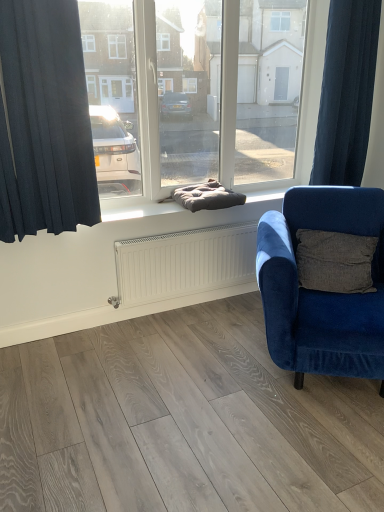
Measure the distance between point (355, 334) and camera.

A distance of 1.84 meters exists between point (355, 334) and camera.

Where is `dark blue fabric curtain at left, which ranks as the 1th curtain in left-to-right order`? dark blue fabric curtain at left, which ranks as the 1th curtain in left-to-right order is located at coordinates (44, 121).

Where is `dark blue fabric curtain at right, the 1th curtain from the right`? The height and width of the screenshot is (512, 384). dark blue fabric curtain at right, the 1th curtain from the right is located at coordinates pos(346,93).

You are a GUI agent. You are given a task and a screenshot of the screen. Output one action in this format:
    pyautogui.click(x=<x>, y=<y>)
    Task: Click on the velvet blue armchair at right
    This screenshot has width=384, height=512.
    Given the screenshot: What is the action you would take?
    pyautogui.click(x=320, y=291)

Is point (10, 150) less distant than point (369, 130)?

Yes.

Can you see dark blue fabric curtain at left, arranged as the 2th curtain when viewed from the back, touching dark blue fabric curtain at right, the 1th curtain from the right?

There is a gap between dark blue fabric curtain at left, arranged as the 2th curtain when viewed from the back, and dark blue fabric curtain at right, the 1th curtain from the right.

From the image's perspective, which is above, dark blue fabric curtain at right, which is the first curtain in back-to-front order, or dark gray cushion at center?

dark blue fabric curtain at right, which is the first curtain in back-to-front order, is shown above in the image.

Between dark blue fabric curtain at right, which is the first curtain in back-to-front order, and dark gray cushion at center, which one has smaller size?

Smaller between the two is dark gray cushion at center.

Is dark blue fabric curtain at right, which is the first curtain in back-to-front order, inside the boundaries of dark gray cushion at center, or outside?

dark blue fabric curtain at right, which is the first curtain in back-to-front order, is not enclosed by dark gray cushion at center.

From a real-world perspective, which object rests below the other?

In real-world perspective, dark gray cushion at center is lower.

Is velvet blue armchair at right aimed at dark gray cushion at center?

Result: No.

Which is closer, (274,330) or (145,211)?

Clearly, point (274,330) is closer to the camera than point (145,211).

Is velvet blue armchair at right behind dark gray cushion at center?

No.

Between velvet blue armchair at right and dark gray cushion at center, which one has larger width?

With larger width is velvet blue armchair at right.

Is dark blue fabric curtain at right, which is counted as the second curtain, starting from the front, bigger than velvet blue armchair at right?

No.

Does point (335, 87) appear closer or farther from the camera than point (382, 218)?

Clearly, point (335, 87) is more distant from the camera than point (382, 218).

How different are the orientations of dark blue fabric curtain at right, marked as the 2th curtain in a left-to-right arrangement, and velvet blue armchair at right in degrees?

The angular difference between dark blue fabric curtain at right, marked as the 2th curtain in a left-to-right arrangement, and velvet blue armchair at right is 33.7 degrees.

Which of these two, dark blue fabric curtain at right, which is counted as the second curtain, starting from the front, or velvet blue armchair at right, stands taller?

Standing taller between the two is dark blue fabric curtain at right, which is counted as the second curtain, starting from the front.

Based on the photo, can you confirm if dark gray cushion at center is wider than dark blue fabric curtain at right, marked as the 2th curtain in a left-to-right arrangement?

Yes.

In terms of size, does dark gray cushion at center appear bigger or smaller than dark blue fabric curtain at right, which is the first curtain in back-to-front order?

Considering their sizes, dark gray cushion at center takes up less space than dark blue fabric curtain at right, which is the first curtain in back-to-front order.

Between point (273, 259) and point (361, 0), which one is positioned behind?

Positioned behind is point (361, 0).

From a real-world perspective, is velvet blue armchair at right physically below dark blue fabric curtain at right, the 1th curtain from the right?

Yes, from a real-world perspective, velvet blue armchair at right is below dark blue fabric curtain at right, the 1th curtain from the right.

Is velvet blue armchair at right shorter than dark blue fabric curtain at right, the 1th curtain from the right?

Yes.

What's the angular difference between velvet blue armchair at right and dark blue fabric curtain at right, which is counted as the second curtain, starting from the front,'s facing directions?

velvet blue armchair at right and dark blue fabric curtain at right, which is counted as the second curtain, starting from the front, are facing 33.7 degrees away from each other.

Can you confirm if dark gray cushion at center is bigger than velvet blue armchair at right?

Actually, dark gray cushion at center might be smaller than velvet blue armchair at right.

Is dark gray cushion at center touching velvet blue armchair at right?

No.

From the image's perspective, is dark gray cushion at center located beneath velvet blue armchair at right?

No, from the image's perspective, dark gray cushion at center is not below velvet blue armchair at right.

This screenshot has height=512, width=384. What are the coordinates of `curtain above the dark blue fabric curtain at left, arranged as the 2th curtain when viewed from the back (from the image's perspective)` in the screenshot? It's located at (346, 93).

From a real-world perspective, which curtain is the 2nd one above the dark gray cushion at center? Please provide its 2D coordinates.

[(346, 93)]

Looking at the image, which one is located closer to dark blue fabric curtain at right, marked as the 2th curtain in a left-to-right arrangement, velvet blue armchair at right or dark blue fabric curtain at left, the first curtain in the front-to-back sequence?

velvet blue armchair at right is closer to dark blue fabric curtain at right, marked as the 2th curtain in a left-to-right arrangement.

Considering their positions, is dark gray cushion at center positioned closer to dark blue fabric curtain at left, the first curtain in the front-to-back sequence, than velvet blue armchair at right?

dark gray cushion at center lies closer to dark blue fabric curtain at left, the first curtain in the front-to-back sequence, than the other object.

Considering their positions, is dark blue fabric curtain at right, the 1th curtain from the right, positioned further to dark gray cushion at center than velvet blue armchair at right?

The object further to dark gray cushion at center is velvet blue armchair at right.

Estimate the real-world distances between objects in this image. Which object is closer to velvet blue armchair at right, dark blue fabric curtain at left, the first curtain in the front-to-back sequence, or dark blue fabric curtain at right, which is the first curtain in back-to-front order?

Among the two, dark blue fabric curtain at right, which is the first curtain in back-to-front order, is located nearer to velvet blue armchair at right.

Considering their positions, is velvet blue armchair at right positioned further to dark blue fabric curtain at left, which ranks as the 1th curtain in left-to-right order, than dark gray cushion at center?

The object further to dark blue fabric curtain at left, which ranks as the 1th curtain in left-to-right order, is velvet blue armchair at right.

Based on their spatial positions, is dark blue fabric curtain at right, the 1th curtain from the right, or dark gray cushion at center further from velvet blue armchair at right?

dark blue fabric curtain at right, the 1th curtain from the right, lies further to velvet blue armchair at right than the other object.

When comparing their distances from dark gray cushion at center, does dark blue fabric curtain at right, which is the first curtain in back-to-front order, or dark blue fabric curtain at left, arranged as the 2th curtain when viewed from the back, seem further?

dark blue fabric curtain at right, which is the first curtain in back-to-front order, is further to dark gray cushion at center.

Consider the image. Looking at the image, which one is located closer to dark gray cushion at center, dark blue fabric curtain at left, the first curtain in the front-to-back sequence, or velvet blue armchair at right?

Among the two, dark blue fabric curtain at left, the first curtain in the front-to-back sequence, is located nearer to dark gray cushion at center.

Identify the location of window sill situated between dark blue fabric curtain at left, arranged as the 2th curtain when viewed from the back, and dark blue fabric curtain at right, marked as the 2th curtain in a left-to-right arrangement, from left to right. (189, 212).

Where is `chair between dark blue fabric curtain at left, which ranks as the 1th curtain in left-to-right order, and dark blue fabric curtain at right, marked as the 2th curtain in a left-to-right arrangement`? The width and height of the screenshot is (384, 512). chair between dark blue fabric curtain at left, which ranks as the 1th curtain in left-to-right order, and dark blue fabric curtain at right, marked as the 2th curtain in a left-to-right arrangement is located at coordinates (320, 291).

Locate an element on the screen. This screenshot has width=384, height=512. window sill between dark blue fabric curtain at right, the 1th curtain from the right, and velvet blue armchair at right vertically is located at coordinates (189, 212).

The width and height of the screenshot is (384, 512). Find the location of `window sill located between dark blue fabric curtain at left, which ranks as the 1th curtain in left-to-right order, and velvet blue armchair at right in the left-right direction`. window sill located between dark blue fabric curtain at left, which ranks as the 1th curtain in left-to-right order, and velvet blue armchair at right in the left-right direction is located at coordinates (189, 212).